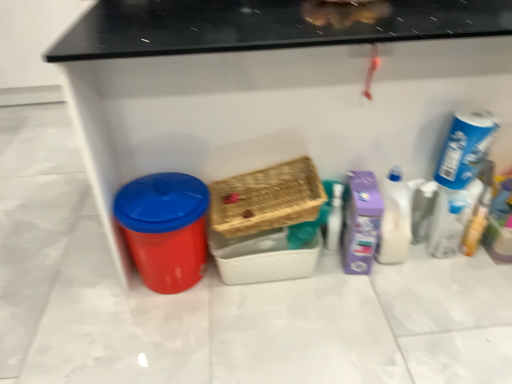
Question: Considering the positions of woven brown basket at center, which appears as the first basket when viewed from the top, and white glossy bottle at right, the 2th cleaning product viewed from the right, in the image, is woven brown basket at center, which appears as the first basket when viewed from the top, bigger or smaller than white glossy bottle at right, the 2th cleaning product viewed from the right,?

Choices:
 (A) small
 (B) big

Answer: (B)

Question: Is point (286, 173) positioned closer to the camera than point (386, 216)?

Choices:
 (A) closer
 (B) farther

Answer: (B)

Question: Which is farther from the purple cardboard box at right, acting as the third cleaning product starting from the right?

Choices:
 (A) transparent plastic bottle at right
 (B) white glossy bottle at right, the 2th cleaning product in the left-to-right sequence
 (C) matte plastic bin at left
 (D) blue cardboard box at upper right, which is the 3th cleaning product in left-to-right order
 (E) woven brown basket at center, which appears as the first basket when viewed from the top

Answer: (C)

Question: Based on their relative distances, which object is farther from the blue cardboard box at upper right, the 1th cleaning product viewed from the right?

Choices:
 (A) purple cardboard box at right, acting as the third cleaning product starting from the right
 (B) woven wood basket at center, arranged as the second basket when viewed from the top
 (C) white glossy bottle at right, the 2th cleaning product viewed from the right
 (D) matte plastic bin at left
 (E) woven brown basket at center, the 2th basket when ordered from bottom to top

Answer: (B)